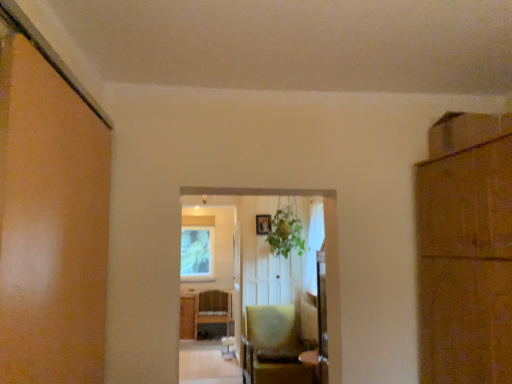
Describe the element at coordinates (285, 233) in the screenshot. I see `green leafy plant at center` at that location.

What is the approximate height of wooden picture frame at center?

wooden picture frame at center is 28.56 centimeters in height.

The width and height of the screenshot is (512, 384). Describe the element at coordinates (197, 252) in the screenshot. I see `white matte window screen at upper center` at that location.

Describe the element at coordinates (274, 347) in the screenshot. This screenshot has width=512, height=384. I see `matte yellow chair at center` at that location.

Find the location of `wooden cabinet at center`. wooden cabinet at center is located at coordinates (212, 314).

I want to click on green leafy plant at center, so click(285, 233).

Consider the image. From a real-world perspective, is matte yellow chair at center physically below brown cardboard cabinet at right?

Correct, in the physical world, matte yellow chair at center is lower than brown cardboard cabinet at right.

Which point is more distant from viewer, (254, 312) or (474, 261)?

Positioned behind is point (254, 312).

Looking at their sizes, would you say matte yellow chair at center is wider or thinner than brown cardboard cabinet at right?

matte yellow chair at center is wider than brown cardboard cabinet at right.

Who is smaller, green leafy plant at center or brown cardboard cabinet at right?

green leafy plant at center is smaller.

Is green leafy plant at center in front of brown cardboard cabinet at right?

Result: No, green leafy plant at center is behind brown cardboard cabinet at right.

Which is further, (295, 245) or (481, 269)?

The point (295, 245) is more distant.

Is green leafy plant at center not close to brown cardboard cabinet at right?

Absolutely, green leafy plant at center is distant from brown cardboard cabinet at right.

From the image's perspective, would you say green leafy plant at center is shown under matte yellow chair at center?

Actually, green leafy plant at center appears above matte yellow chair at center in the image.

Does green leafy plant at center turn towards matte yellow chair at center?

No, green leafy plant at center does not turn towards matte yellow chair at center.

Is green leafy plant at center far away from matte yellow chair at center?

Yes, green leafy plant at center and matte yellow chair at center are located far from each other.

Which object is closer to the camera, green leafy plant at center or matte yellow chair at center?

matte yellow chair at center is more forward.

Is brown cardboard cabinet at right surrounding matte yellow chair at center?

No, brown cardboard cabinet at right does not contain matte yellow chair at center.

Is brown cardboard cabinet at right in front of or behind matte yellow chair at center in the image?

Clearly, brown cardboard cabinet at right is in front of matte yellow chair at center.

Could you tell me if brown cardboard cabinet at right is turned towards matte yellow chair at center?

No, brown cardboard cabinet at right is not aimed at matte yellow chair at center.

From a real-world perspective, is wooden picture frame at center physically above green leafy plant at center?

Yes, from a real-world perspective, wooden picture frame at center is over green leafy plant at center

Is wooden picture frame at center placed right next to green leafy plant at center?

No, wooden picture frame at center is not beside green leafy plant at center.

Is wooden picture frame at center oriented towards green leafy plant at center?

Yes, wooden picture frame at center is oriented towards green leafy plant at center.

You are a GUI agent. You are given a task and a screenshot of the screen. Output one action in this format:
    pyautogui.click(x=<x>, y=<y>)
    Task: Click on the picture frame located above the green leafy plant at center (from a real-world perspective)
    This screenshot has width=512, height=384.
    Given the screenshot: What is the action you would take?
    pyautogui.click(x=263, y=224)

Measure the distance between wooden cabinet at center and matte yellow chair at center.

wooden cabinet at center is 1.37 meters from matte yellow chair at center.

Are wooden cabinet at center and matte yellow chair at center beside each other?

No, wooden cabinet at center is not next to matte yellow chair at center.

The height and width of the screenshot is (384, 512). What are the coordinates of `chair that appears in front of the wooden cabinet at center` in the screenshot? It's located at (274, 347).

Which is more to the left, brown cardboard cabinet at right or green leafy plant at center?

Positioned to the left is green leafy plant at center.

Is brown cardboard cabinet at right not inside green leafy plant at center?

brown cardboard cabinet at right lies outside green leafy plant at center's area.

From a real-world perspective, is brown cardboard cabinet at right on green leafy plant at center?

No, from a real-world perspective, brown cardboard cabinet at right is not over green leafy plant at center

What are the coordinates of `chair below the brown cardboard cabinet at right (from the image's perspective)` in the screenshot? It's located at (274, 347).

The width and height of the screenshot is (512, 384). I want to click on plant that is behind the brown cardboard cabinet at right, so click(285, 233).

Looking at the image, which one is located further to wooden cabinet at center, brown cardboard cabinet at right or white matte window screen at upper center?

Based on the image, brown cardboard cabinet at right appears to be further to wooden cabinet at center.

From the image, which object appears to be farther from green leafy plant at center, brown cardboard cabinet at right or matte yellow chair at center?

brown cardboard cabinet at right.

From the image, which object appears to be farther from wooden cabinet at center, white matte window screen at upper center or brown cardboard cabinet at right?

brown cardboard cabinet at right.

Consider the image. Estimate the real-world distances between objects in this image. Which object is closer to matte yellow chair at center, green leafy plant at center or white matte window screen at upper center?

green leafy plant at center lies closer to matte yellow chair at center than the other object.

Based on their spatial positions, is white matte window screen at upper center or wooden cabinet at center closer to green leafy plant at center?

white matte window screen at upper center lies closer to green leafy plant at center than the other object.

Based on their spatial positions, is wooden picture frame at center or white matte window screen at upper center closer to wooden cabinet at center?

white matte window screen at upper center is closer to wooden cabinet at center.

When comparing their distances from brown cardboard cabinet at right, does white matte window screen at upper center or matte yellow chair at center seem further?

white matte window screen at upper center.

Looking at the image, which one is located further to wooden picture frame at center, white matte window screen at upper center or brown cardboard cabinet at right?

brown cardboard cabinet at right is further to wooden picture frame at center.

Where is `chair between brown cardboard cabinet at right and wooden cabinet at center in the front-back direction`? The height and width of the screenshot is (384, 512). chair between brown cardboard cabinet at right and wooden cabinet at center in the front-back direction is located at coordinates (274, 347).

This screenshot has height=384, width=512. In order to click on chair positioned between brown cardboard cabinet at right and wooden picture frame at center from near to far in this screenshot , I will do `click(274, 347)`.

This screenshot has width=512, height=384. Find the location of `plant positioned between matte yellow chair at center and wooden cabinet at center from near to far`. plant positioned between matte yellow chair at center and wooden cabinet at center from near to far is located at coordinates [285, 233].

The height and width of the screenshot is (384, 512). Find the location of `plant between brown cardboard cabinet at right and wooden picture frame at center along the z-axis`. plant between brown cardboard cabinet at right and wooden picture frame at center along the z-axis is located at coordinates (285, 233).